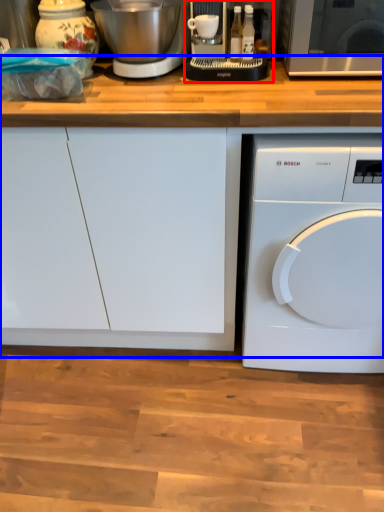
Question: Which of the following is the closest to the observer, food processor (highlighted by a red box) or counter top (highlighted by a blue box)?

Choices:
 (A) food processor
 (B) counter top

Answer: (B)